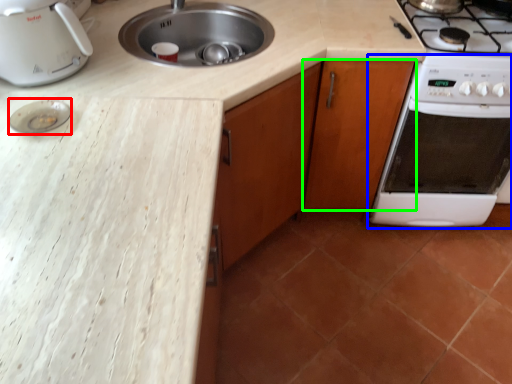
Question: Based on their relative distances, which object is nearer to appliance (highlighted by a red box)? Choose from oven (highlighted by a blue box) and cabinetry (highlighted by a green box).

Choices:
 (A) oven
 (B) cabinetry

Answer: (B)